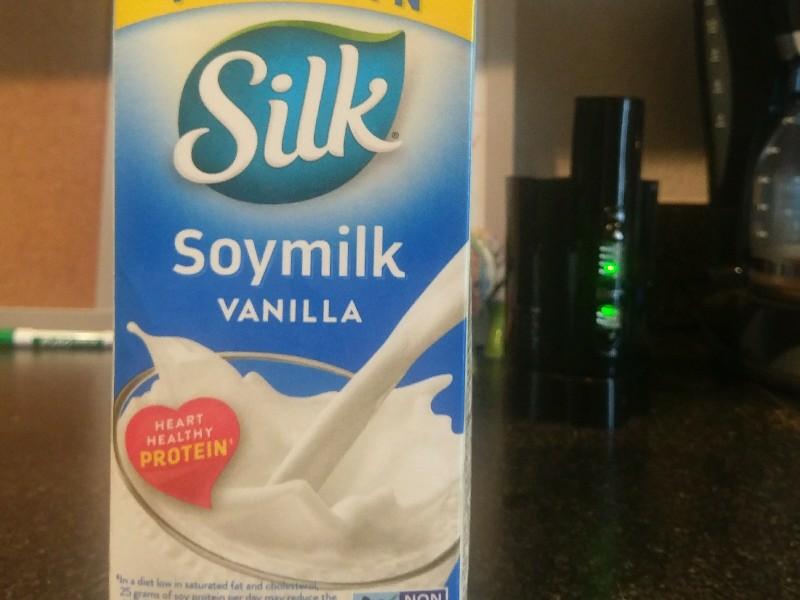
I want to click on coffeemaker, so click(734, 95), click(790, 44), click(774, 331).